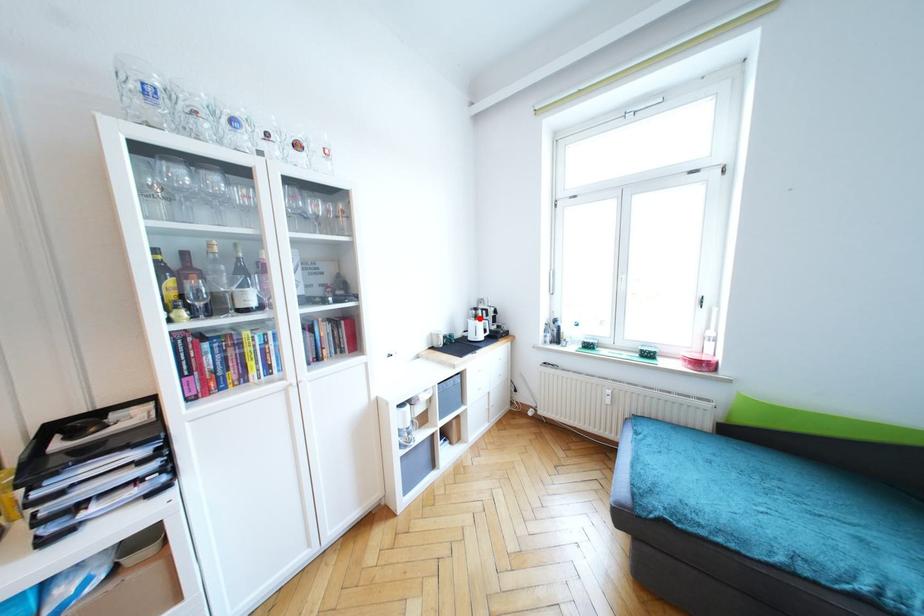
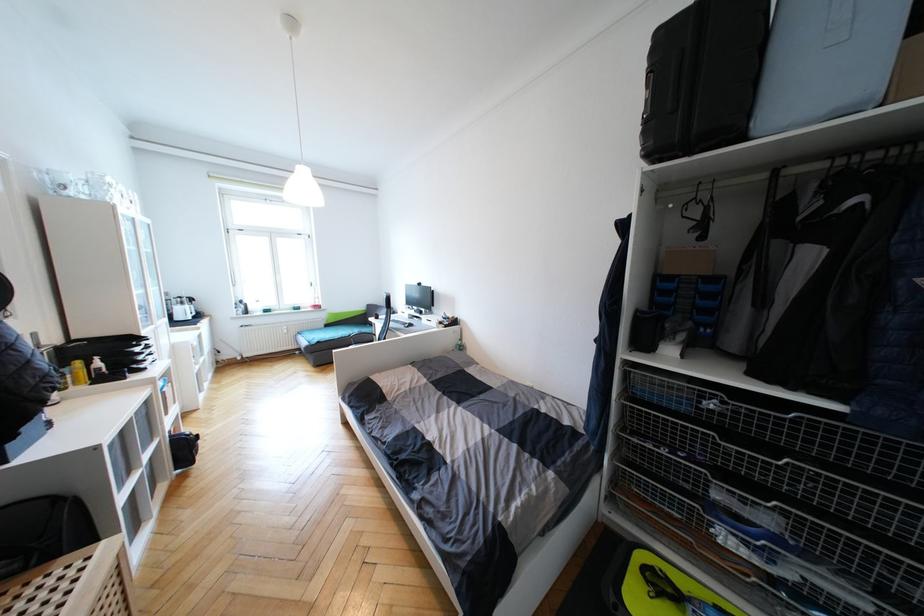
Question: I am providing you with two images of the same scene from different viewpoints. In image1, a red point is highlighted. Considering the same 3D point in image2, which of the following is correct?

Choices:
 (A) It is closer
 (B) It is farther

Answer: (A)